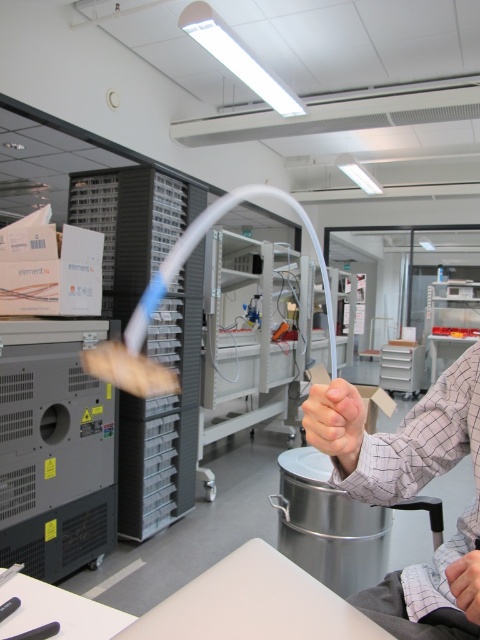
Question: Does matte skin hand at center appear over smooth skin hand at lower right?

Choices:
 (A) yes
 (B) no

Answer: (A)

Question: Does transparent plastic tube at center appear over matte skin hand at center?

Choices:
 (A) yes
 (B) no

Answer: (A)

Question: Which point is farther to the camera?

Choices:
 (A) (137, 337)
 (B) (360, 444)
 (C) (156, 616)
 (D) (462, 557)

Answer: (A)

Question: Is white matte table at lower center to the right of smooth skin hand at lower right from the viewer's perspective?

Choices:
 (A) yes
 (B) no

Answer: (B)

Question: Which of the following is the farthest from the observer?

Choices:
 (A) transparent plastic tube at center
 (B) white matte table at lower center
 (C) smooth skin hand at lower right
 (D) matte skin hand at center

Answer: (A)

Question: Which object is closer to the camera taking this photo?

Choices:
 (A) matte skin hand at center
 (B) transparent plastic tube at center

Answer: (A)